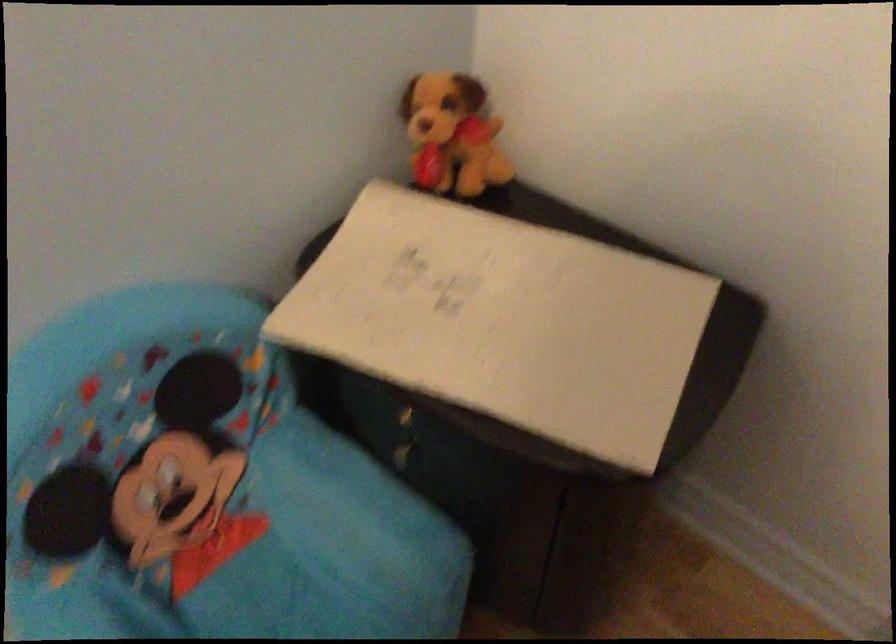
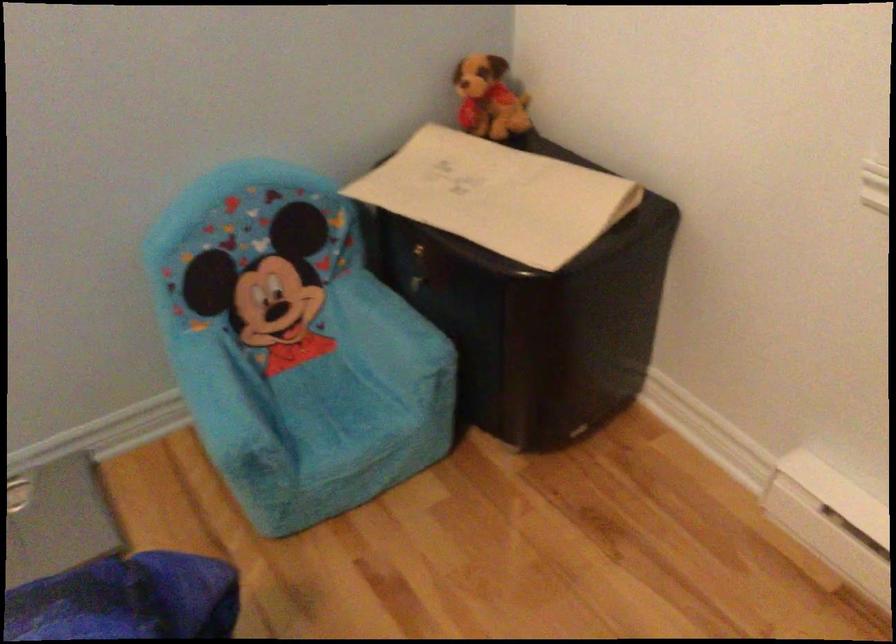
Question: I am providing you with two images of the same scene from different viewpoints. Which of the following objects are not visible in image2?

Choices:
 (A) paper folder
 (B) cabinet drawer handle
 (C) stuffed dog toy
 (D) none of these

Answer: (D)